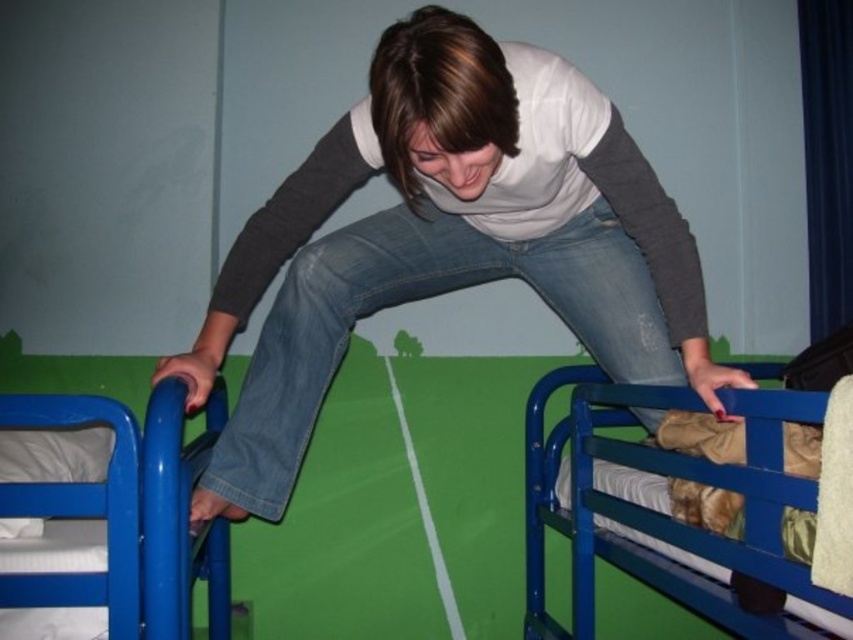
You are trying to reach a book on the shelf behind the blue metallic bunk bed at left. You are standing near the jeans at center. Which direction should you move to get a better view of the book?

Since the blue metallic bunk bed at left is behind the jeans at center, you should move to the right of the jeans at center to get a better view of the book behind the bunk bed.

You are trying to decide whether to place a new rectangular storage box that is 1.2 meters wide between the jeans at center and the blue metallic bunk bed at left. Based on their widths, will the storage box fit in the space between them?

The jeans at center is wider than the blue metallic bunk bed at left. However, the exact width difference isn not specified, so it is uncertain if the 1.2 meter wide storage box will fit between them.

You are trying to reach a book on a shelf located at point 0.8, 0.8. You see the blue metal bunk bed at upper right. Is the bunk bed in a good position to help you reach the shelf?

The blue metal bunk bed at upper right is located at point (666, 509), which is very close to the shelf at (682, 512). You can use the bunk bed to reach the shelf.